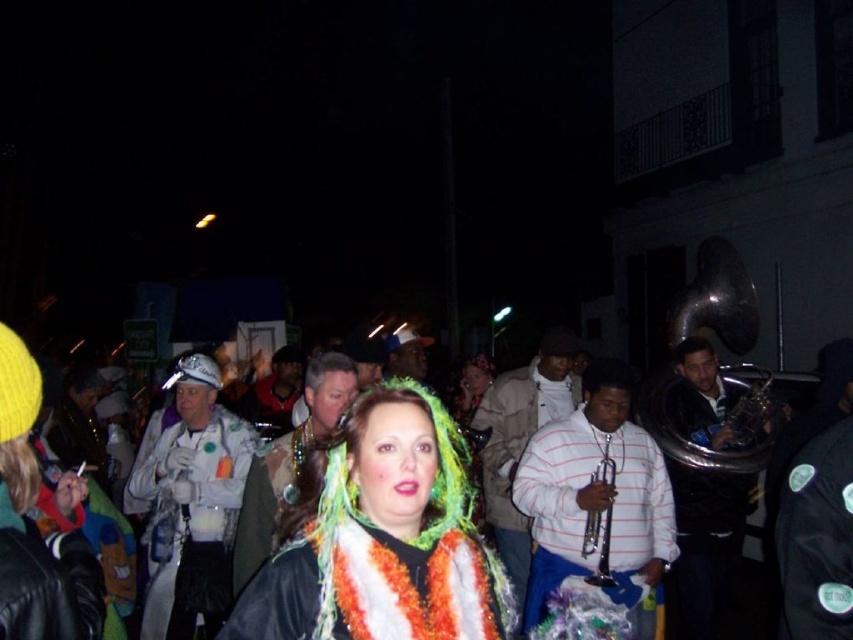
You are a photographer trying to capture a clear shot of the white fabric mask at center and the white striped shirt at center during this nighttime event. Since the lighting is low, you want to ensure both objects are visible. Which object should you focus on first to ensure it appears larger in your photo, given their sizes?

The white fabric mask at center has a lesser width compared to the white striped shirt at center, so you should focus on the white striped shirt at center first since it is wider and might be easier to capture clearly in low light.

In the scene shown: You are a photographer standing at the center of the scene. You want to capture a closeup shot of the white fabric mask at center. Which direction should you move to get closer to it?

The white fabric mask at center is located at point 0.812 on the x axis and 0.226 on the y axis. Since you are at the center of the scene, you should move towards the right and slightly downward to reach the mask.